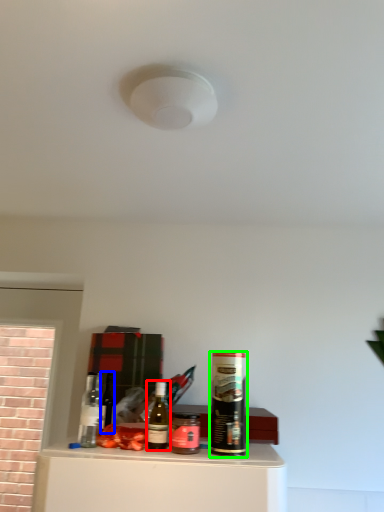
Question: Estimate the real-world distances between objects in this image. Which object is closer to bottle (highlighted by a red box), wine bottle (highlighted by a blue box) or beverage (highlighted by a green box)?

Choices:
 (A) wine bottle
 (B) beverage

Answer: (B)